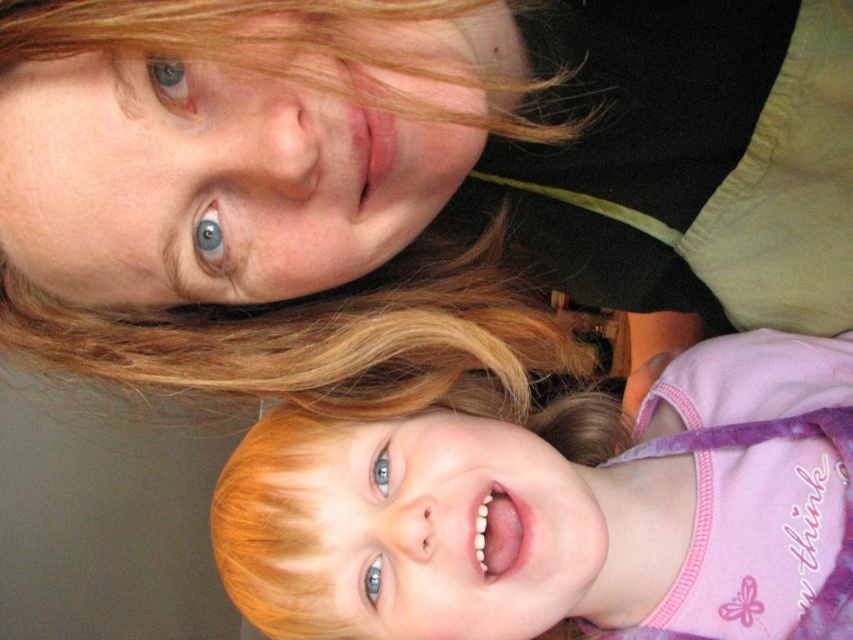
Based on the scene described, which object has a wider appearance between the smooth blonde hair at lower center and the blonde hair at upper left?

The smooth blonde hair at lower center might be wider than the blonde hair at upper left according to the description.

Based on the scene description, which object is positioned lower between the smooth blonde hair at lower center and the blonde hair at upper left?

The smooth blonde hair at lower center is positioned lower than the blonde hair at upper left.